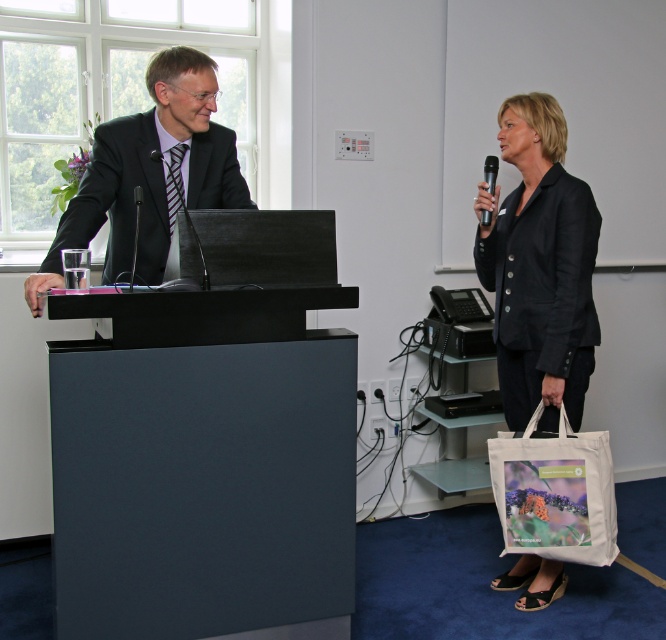
You are an event coordinator and need to arrange seating for the speakers. The person in the black matte blazer at right is the guest speaker, and the person in the matte black suit at left is the host. Based on their positions in the image, which speaker should you seat closer to the main entrance of the stage?

The person in the black matte blazer at right should be seated closer to the main entrance of the stage because they are positioned on the right side of the matte black suit at left, indicating they might be the guest speaker who typically enters first.

You are organizing a small event and need to set up a microphone stand. The stand requires the base to be at least 1.2 meters tall to remain stable. Given the height of the matte black podium at left and the black plastic microphone at upper right, can the microphone stand be placed next to the podium without compromising stability?

The matte black podium at left is much taller than the black plastic microphone at upper right. Since the podium is much taller, it likely meets the 1.2 meter requirement, so placing the microphone stand next to it should be stable.